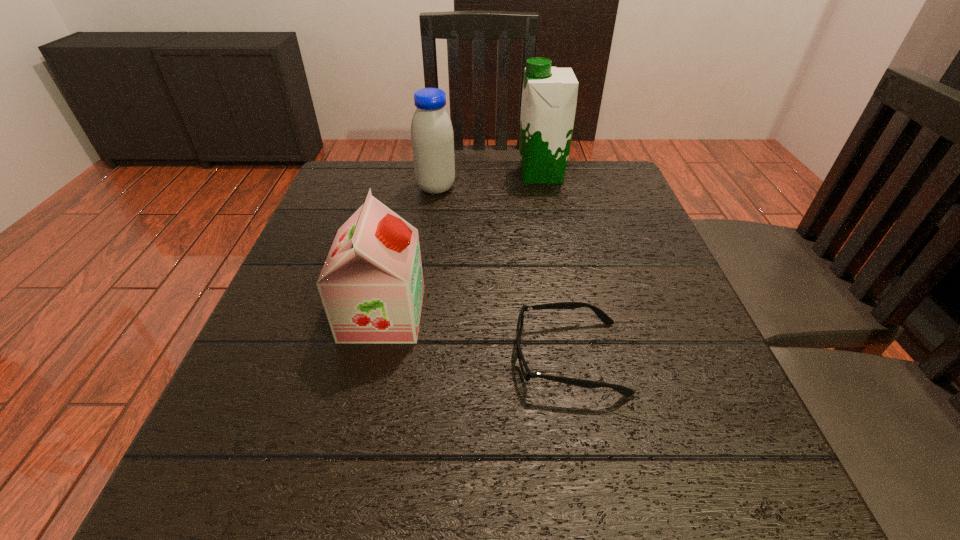
Where is `the tallest object`? the tallest object is located at coordinates (549, 96).

Locate an element on the screen. The image size is (960, 540). the rightmost soya milk is located at coordinates pyautogui.click(x=549, y=96).

This screenshot has width=960, height=540. Find the location of `the nearest soya milk`. the nearest soya milk is located at coordinates (371, 285).

This screenshot has width=960, height=540. I want to click on spectacles, so [x=527, y=374].

At what (x,y) coordinates should I click in order to perform the action: click on vacant space located on the front-facing side of the rightmost soya milk. Please return your answer as a coordinate pair (x, y). Image resolution: width=960 pixels, height=540 pixels. Looking at the image, I should click on (366, 174).

Identify the location of vacant area situated on the front-facing side of the rightmost soya milk. This screenshot has width=960, height=540. (453, 174).

This screenshot has height=540, width=960. Find the location of `vacant region located 0.320m on the front-facing side of the rightmost soya milk`. vacant region located 0.320m on the front-facing side of the rightmost soya milk is located at coordinates (396, 174).

This screenshot has height=540, width=960. In order to click on vacant space located 0.100m with the cap open on the nearest soya milk in this screenshot , I will do `click(476, 314)`.

Where is `vacant region located 0.360m on the front-facing side of the shortest object`? The height and width of the screenshot is (540, 960). vacant region located 0.360m on the front-facing side of the shortest object is located at coordinates (295, 357).

Find the location of a particular element. vacant space positioned 0.070m on the front-facing side of the shortest object is located at coordinates (472, 357).